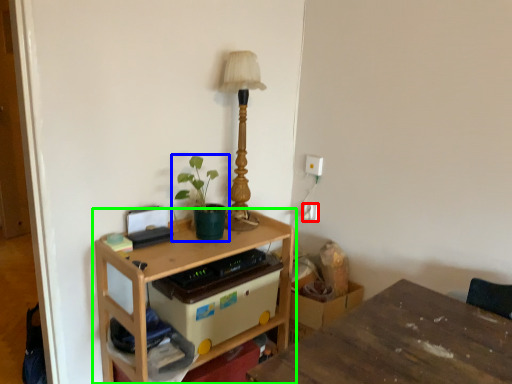
Question: Which is farther away from electric outlet (highlighted by a red box)? houseplant (highlighted by a blue box) or table (highlighted by a green box)?

Choices:
 (A) houseplant
 (B) table

Answer: (B)